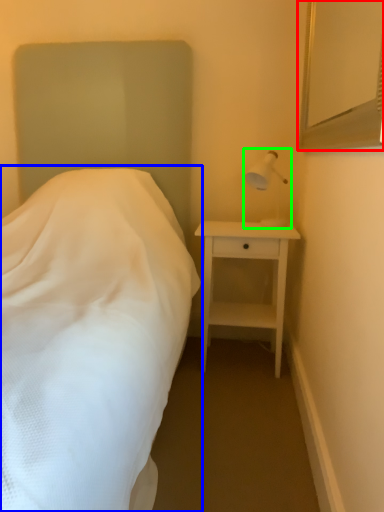
Question: Which is nearer to the mirror (highlighted by a red box)? bed (highlighted by a blue box) or bedside lamp (highlighted by a green box).

Choices:
 (A) bed
 (B) bedside lamp

Answer: (B)